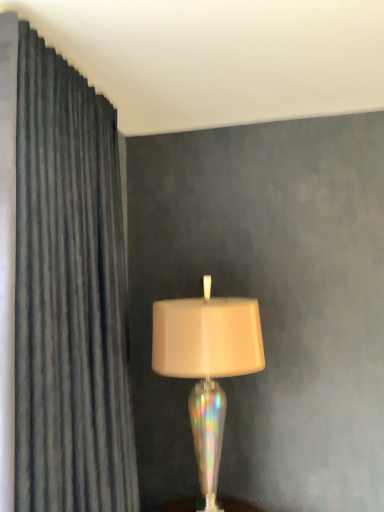
The width and height of the screenshot is (384, 512). Describe the element at coordinates (69, 295) in the screenshot. I see `dark gray textured curtain at left` at that location.

Identify the location of dark gray textured curtain at left. click(x=69, y=295).

Identify the location of iridescent glass lamp at center. The width and height of the screenshot is (384, 512). (207, 365).

Describe the element at coordinates (207, 365) in the screenshot. I see `iridescent glass lamp at center` at that location.

Where is `dark gray textured curtain at left`? The width and height of the screenshot is (384, 512). dark gray textured curtain at left is located at coordinates (69, 295).

Considering the relative positions of iridescent glass lamp at center and dark gray textured curtain at left in the image provided, is iridescent glass lamp at center to the left of dark gray textured curtain at left from the viewer's perspective?

In fact, iridescent glass lamp at center is to the right of dark gray textured curtain at left.

In the image, is iridescent glass lamp at center positioned in front of or behind dark gray textured curtain at left?

iridescent glass lamp at center is behind dark gray textured curtain at left.

Does point (170, 336) come behind point (112, 403)?

Yes, point (170, 336) is behind point (112, 403).

From the image's perspective, is iridescent glass lamp at center on top of dark gray textured curtain at left?

No, from the image's perspective, iridescent glass lamp at center is not on top of dark gray textured curtain at left.

From a real-world perspective, which object rests below the other?

iridescent glass lamp at center, from a real-world perspective.

Consider the image. Which object is thinner, iridescent glass lamp at center or dark gray textured curtain at left?

dark gray textured curtain at left is thinner.

Does iridescent glass lamp at center have a lesser height compared to dark gray textured curtain at left?

Yes.

Considering the relative sizes of iridescent glass lamp at center and dark gray textured curtain at left in the image provided, is iridescent glass lamp at center bigger than dark gray textured curtain at left?

Incorrect, iridescent glass lamp at center is not larger than dark gray textured curtain at left.

Is iridescent glass lamp at center inside or outside of dark gray textured curtain at left?

iridescent glass lamp at center is spatially situated outside dark gray textured curtain at left.

Is iridescent glass lamp at center beside dark gray textured curtain at left?

No, iridescent glass lamp at center is not next to dark gray textured curtain at left.

Is iridescent glass lamp at center oriented towards dark gray textured curtain at left?

No.

What's the angular difference between iridescent glass lamp at center and dark gray textured curtain at left's facing directions?

The angular difference between iridescent glass lamp at center and dark gray textured curtain at left is 89.3 degrees.

At what (x,y) coordinates should I click in order to perform the action: click on curtain in front of the iridescent glass lamp at center. Please return your answer as a coordinate pair (x, y). Looking at the image, I should click on (69, 295).

Considering the positions of objects dark gray textured curtain at left and iridescent glass lamp at center in the image provided, who is more to the left, dark gray textured curtain at left or iridescent glass lamp at center?

dark gray textured curtain at left is more to the left.

Which object is further away from the camera, dark gray textured curtain at left or iridescent glass lamp at center?

iridescent glass lamp at center is behind.

Considering the points (57, 333) and (222, 373), which point is in front, point (57, 333) or point (222, 373)?

The point (57, 333) is closer.

From the image's perspective, which object appears higher, dark gray textured curtain at left or iridescent glass lamp at center?

dark gray textured curtain at left appears higher in the image.

From a real-world perspective, relative to iridescent glass lamp at center, is dark gray textured curtain at left vertically above or below?

In terms of real-world spatial position, dark gray textured curtain at left is above iridescent glass lamp at center.

Considering the relative sizes of dark gray textured curtain at left and iridescent glass lamp at center in the image provided, is dark gray textured curtain at left thinner than iridescent glass lamp at center?

Indeed, dark gray textured curtain at left has a lesser width compared to iridescent glass lamp at center.

Looking at this image, between dark gray textured curtain at left and iridescent glass lamp at center, which one has more height?

Standing taller between the two is dark gray textured curtain at left.

Consider the image. Between dark gray textured curtain at left and iridescent glass lamp at center, which one has smaller size?

With smaller size is iridescent glass lamp at center.

Is dark gray textured curtain at left outside of iridescent glass lamp at center?

Yes, dark gray textured curtain at left is located beyond the bounds of iridescent glass lamp at center.

Is dark gray textured curtain at left not close to iridescent glass lamp at center?

No, dark gray textured curtain at left is not far away from iridescent glass lamp at center.

Is iridescent glass lamp at center at the back of dark gray textured curtain at left?

That's not correct — dark gray textured curtain at left is not looking away from iridescent glass lamp at center.

How different are the orientations of dark gray textured curtain at left and iridescent glass lamp at center in degrees?

89.3 degrees separate the facing orientations of dark gray textured curtain at left and iridescent glass lamp at center.

How far apart are dark gray textured curtain at left and iridescent glass lamp at center?

dark gray textured curtain at left is 17.22 inches away from iridescent glass lamp at center.

Find the location of a particular element. The height and width of the screenshot is (512, 384). lamp on the right of dark gray textured curtain at left is located at coordinates (207, 365).

You are a GUI agent. You are given a task and a screenshot of the screen. Output one action in this format:
    pyautogui.click(x=<x>, y=<y>)
    Task: Click on the curtain above the iridescent glass lamp at center (from a real-world perspective)
    The width and height of the screenshot is (384, 512).
    Given the screenshot: What is the action you would take?
    pyautogui.click(x=69, y=295)

At what (x,y) coordinates should I click in order to perform the action: click on curtain lying in front of the iridescent glass lamp at center. Please return your answer as a coordinate pair (x, y). Looking at the image, I should click on (69, 295).